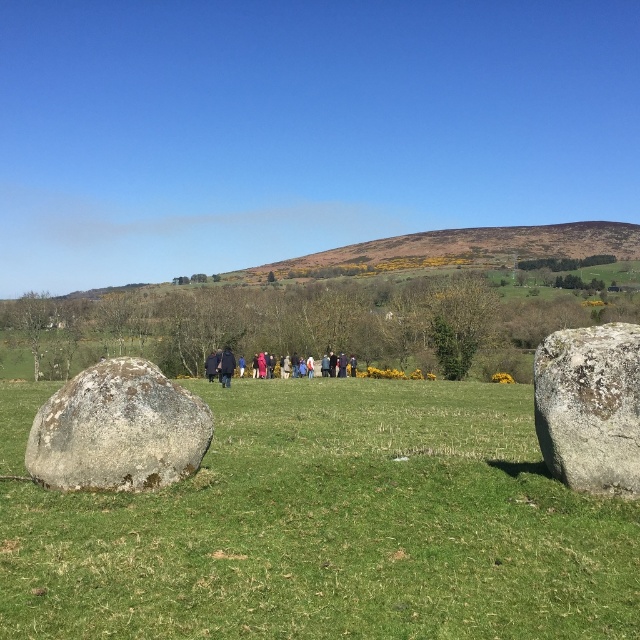
Question: Can you confirm if speckled gray rock at center is bigger than multicolored fabric group at center?

Choices:
 (A) yes
 (B) no

Answer: (B)

Question: Does green grassy at center have a smaller size compared to dark blue coat at center?

Choices:
 (A) yes
 (B) no

Answer: (B)

Question: Which of the following is the closest to the observer?

Choices:
 (A) (225, 356)
 (B) (140, 445)
 (C) (227, 358)

Answer: (B)

Question: Considering the real-world distances, which object is closest to the green grassy at center?

Choices:
 (A) multicolored fabric group at center
 (B) dark blue coat at center
 (C) gray rough boulder at left

Answer: (C)

Question: In this image, where is multicolored fabric group at center located relative to dark blue coat at center?

Choices:
 (A) left
 (B) right

Answer: (B)

Question: Which object is farther from the camera taking this photo?

Choices:
 (A) green grassy at center
 (B) brown grassy hillside at center
 (C) multicolored fabric group at center

Answer: (B)